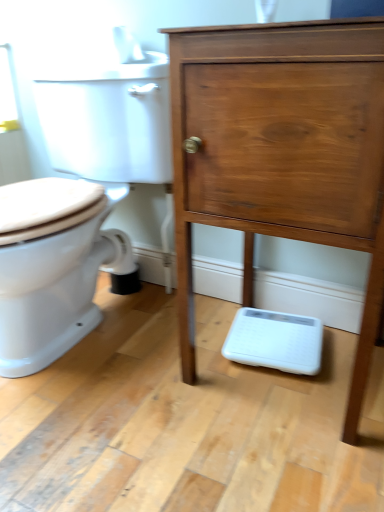
Where is `vacant space positioned to the left of matte wood chest of drawers at center`? The height and width of the screenshot is (512, 384). vacant space positioned to the left of matte wood chest of drawers at center is located at coordinates (151, 398).